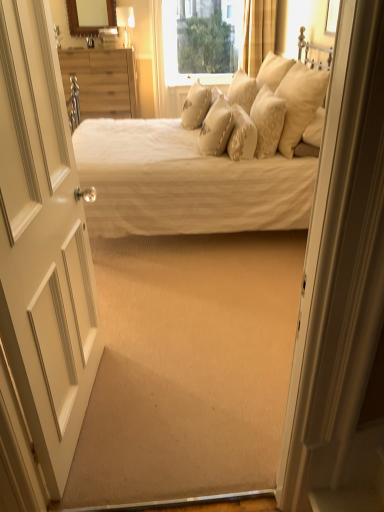
Question: Is clear glass window at upper center looking in the opposite direction of creamy satin pillows at upper center, which is the 5th pillow from left to right?

Choices:
 (A) no
 (B) yes

Answer: (A)

Question: Is the position of clear glass window at upper center more distant than that of creamy satin pillows at upper center, which is the 5th pillow from left to right?

Choices:
 (A) no
 (B) yes

Answer: (B)

Question: From the image's perspective, is clear glass window at upper center beneath creamy satin pillows at upper center, which appears as the second pillow when viewed from the right?

Choices:
 (A) no
 (B) yes

Answer: (A)

Question: Could creamy satin pillows at upper center, which appears as the second pillow when viewed from the right, be considered to be inside clear glass window at upper center?

Choices:
 (A) yes
 (B) no

Answer: (B)

Question: Can we say clear glass window at upper center lies outside creamy satin pillows at upper center, which appears as the second pillow when viewed from the right?

Choices:
 (A) yes
 (B) no

Answer: (A)

Question: Can you confirm if clear glass window at upper center is bigger than creamy satin pillows at upper center, which is the 5th pillow from left to right?

Choices:
 (A) no
 (B) yes

Answer: (B)

Question: Could you tell me if creamy beige fabric pillow at center, which is the 3th pillow from left to right, is facing matte gold lampshade at upper center?

Choices:
 (A) no
 (B) yes

Answer: (A)

Question: Could matte gold lampshade at upper center be considered to be inside creamy beige fabric pillow at center, which is the 3th pillow from left to right?

Choices:
 (A) no
 (B) yes

Answer: (A)

Question: Does creamy beige fabric pillow at center, arranged as the 4th pillow when viewed from the right, have a greater height compared to matte gold lampshade at upper center?

Choices:
 (A) no
 (B) yes

Answer: (A)

Question: Can you confirm if creamy beige fabric pillow at center, which is the 3th pillow from left to right, is thinner than matte gold lampshade at upper center?

Choices:
 (A) no
 (B) yes

Answer: (A)

Question: From a real-world perspective, does creamy beige fabric pillow at center, which is the 3th pillow from left to right, sit lower than matte gold lampshade at upper center?

Choices:
 (A) no
 (B) yes

Answer: (B)

Question: Is creamy beige fabric pillow at center, arranged as the 4th pillow when viewed from the right, outside of matte gold lampshade at upper center?

Choices:
 (A) yes
 (B) no

Answer: (A)

Question: Is white textured bed at center to the left of beige textured pillow at center, placed as the 5th pillow when sorted from right to left, from the viewer's perspective?

Choices:
 (A) yes
 (B) no

Answer: (A)